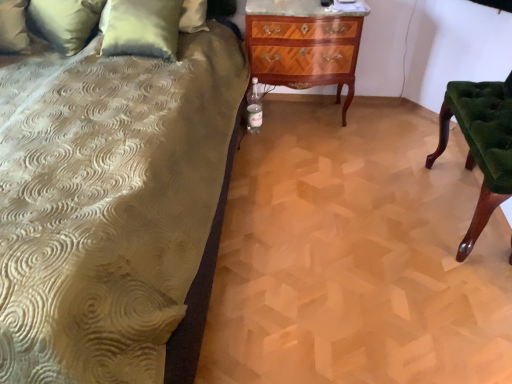
Question: Is mahogany wood chest of drawers at center looking in the opposite direction of green velvet chair at right?

Choices:
 (A) no
 (B) yes

Answer: (A)

Question: Considering the relative positions of mahogany wood chest of drawers at center and green velvet chair at right in the image provided, is mahogany wood chest of drawers at center to the right of green velvet chair at right from the viewer's perspective?

Choices:
 (A) yes
 (B) no

Answer: (B)

Question: Considering the relative sizes of mahogany wood chest of drawers at center and green velvet chair at right in the image provided, is mahogany wood chest of drawers at center wider than green velvet chair at right?

Choices:
 (A) no
 (B) yes

Answer: (B)

Question: Is the depth of mahogany wood chest of drawers at center less than that of green velvet chair at right?

Choices:
 (A) no
 (B) yes

Answer: (A)

Question: Can you confirm if mahogany wood chest of drawers at center is taller than green velvet chair at right?

Choices:
 (A) yes
 (B) no

Answer: (A)

Question: Considering their positions, is velvet green pillow at upper left, marked as the 2th pillow in a left-to-right arrangement, located in front of or behind green velvet chair at right?

Choices:
 (A) behind
 (B) front

Answer: (A)

Question: From a real-world perspective, is velvet green pillow at upper left, which is the 1th pillow from right to left, positioned above or below green velvet chair at right?

Choices:
 (A) above
 (B) below

Answer: (A)

Question: In terms of height, does velvet green pillow at upper left, which is the 1th pillow from right to left, look taller or shorter compared to green velvet chair at right?

Choices:
 (A) tall
 (B) short

Answer: (A)

Question: From the image's perspective, is velvet green pillow at upper left, which is the 1th pillow from right to left, positioned above or below green velvet chair at right?

Choices:
 (A) below
 (B) above

Answer: (B)

Question: Based on their sizes in the image, would you say mahogany wood chest of drawers at center is bigger or smaller than velvet green pillow at upper left, which is the 1th pillow from right to left?

Choices:
 (A) small
 (B) big

Answer: (B)

Question: Is mahogany wood chest of drawers at center to the left or to the right of velvet green pillow at upper left, marked as the 2th pillow in a left-to-right arrangement, in the image?

Choices:
 (A) right
 (B) left

Answer: (A)

Question: Is point (350, 41) positioned closer to the camera than point (166, 46)?

Choices:
 (A) farther
 (B) closer

Answer: (A)

Question: From the image's perspective, is mahogany wood chest of drawers at center positioned above or below velvet green pillow at upper left, marked as the 2th pillow in a left-to-right arrangement?

Choices:
 (A) below
 (B) above

Answer: (A)

Question: Is mahogany wood chest of drawers at center inside or outside of green velvet chair at right?

Choices:
 (A) inside
 (B) outside

Answer: (B)

Question: In the image, is mahogany wood chest of drawers at center positioned in front of or behind green velvet chair at right?

Choices:
 (A) front
 (B) behind

Answer: (B)